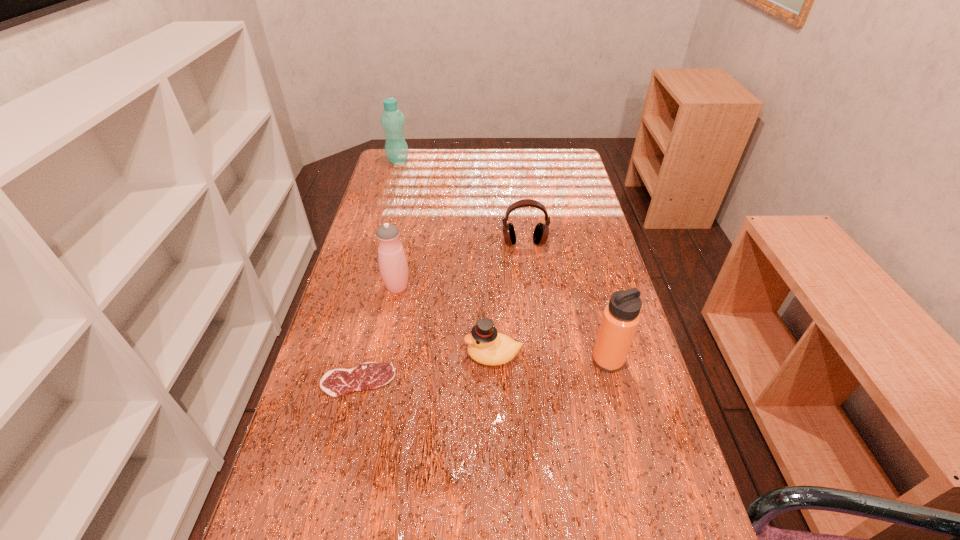
At what (x,y) coordinates should I click in order to perform the action: click on steak located at the left edge. Please return your answer as a coordinate pair (x, y). Looking at the image, I should click on (369, 375).

Where is `object that is positioned at the right edge`? The image size is (960, 540). object that is positioned at the right edge is located at coordinates (621, 316).

Where is `object present at the far left corner`? This screenshot has height=540, width=960. object present at the far left corner is located at coordinates (392, 120).

Find the location of `vacant space at the far edge of the desktop`. vacant space at the far edge of the desktop is located at coordinates (481, 157).

In the image, there is a desktop. Identify the location of free region at the left edge. (390, 198).

This screenshot has height=540, width=960. In the image, there is a desktop. In order to click on vacant space at the right edge in this screenshot , I will do `click(579, 309)`.

The width and height of the screenshot is (960, 540). I want to click on vacant space at the far left corner of the desktop, so click(x=410, y=161).

Find the location of a particular element. This screenshot has width=960, height=540. free space between the shortest object and the left thermos bottle is located at coordinates (377, 334).

This screenshot has height=540, width=960. Identify the location of vacant point located between the rightmost object and the second shortest object. (550, 357).

Locate an element on the screen. free space between the shortest object and the duck is located at coordinates (426, 368).